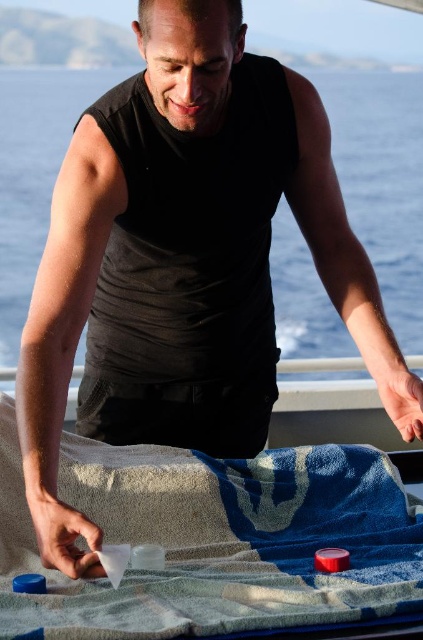
You are a photographer trying to capture the man and his containers. You need to place a tripod to the left of both the blue textured towel at lower center and the black matte towel at lower center. Is there enough space between them to set up the tripod?

The blue textured towel at lower center is positioned on the right side of the black matte towel at lower center, so there is space between them to place the tripod to the left of both.

You are a photographer setting up a shoot on a boat. You have two towels, the blue textured towel at lower center and the black matte towel at lower center. Which towel should you use as the background to ensure the containers are clearly visible against it?

The blue textured towel at lower center is positioned under the black matte towel at lower center. Since the blue towel is underneath, it is already serving as the background for the containers. To ensure visibility, choose the black matte towel at lower center as the background because its matte finish and dark color contrast better with the light containers.

You are standing 5 feet away from the point at coordinates point (181, 563). Can you reach it without moving your feet?

The distance of point (181, 563) from viewer is 4.54 feet, so yes, you can reach it without moving your feet since it is within 5 feet.